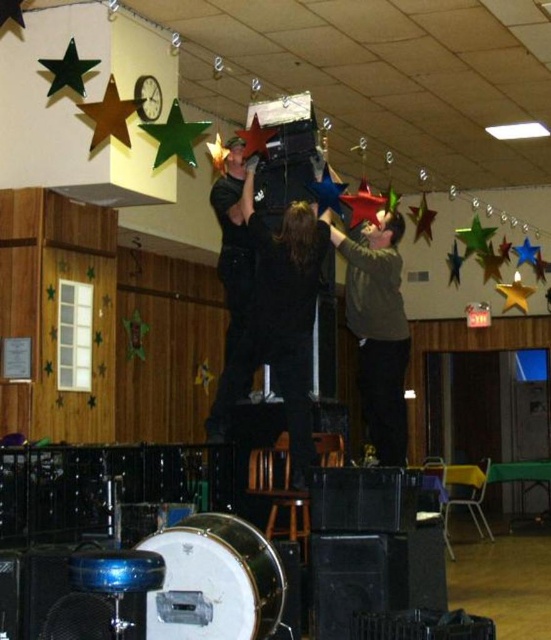
You are helping to hang decorations in the community hall. You need to place a new red star ornament between the gold metallic star at upper left and the metallic blue star at center. Based on their current positions, where should you position the new red star ornament?

Since the gold metallic star at upper left is to the left of the metallic blue star at center, you should place the new red star ornament between them, aligning it to the right of the gold metallic star at upper left and to the left of the metallic blue star at center to maintain the spatial arrangement.

You are planning to hang a new string of fairy lights between the gold metallic star at upper left and the metallic blue star at center. Based on their positions, which star is closer to the ceiling? Please explain your reasoning.

The gold metallic star at upper left has a lesser height compared to the metallic blue star at center, meaning it is lower. Therefore, the metallic blue star at center is closer to the ceiling since it is positioned higher than the gold star.

You are setting up decorations in the community hall and need to hang a new metallic blue star at center. According to the layout, where should you place it?

The metallic blue star at center should be placed at point coordinates [326,193] as specified in the layout.